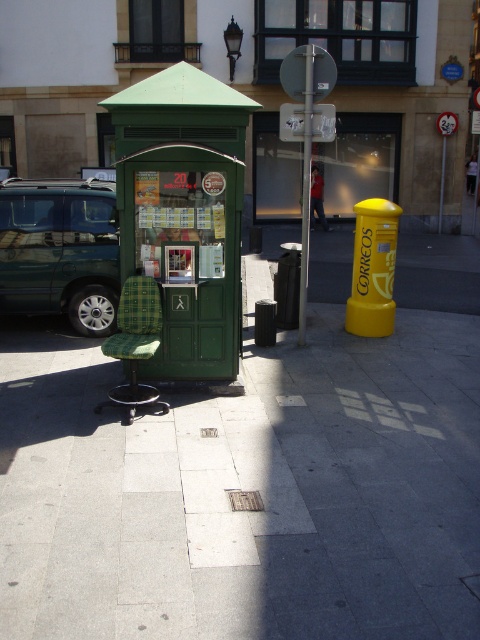
You are a bus driver who needs to park your bus at the green matte bus stop at center. However, there is a metallic silver pole at center above it. Will the pole interfere with parking the bus there?

The green matte bus stop at center is positioned under the metallic silver pole at center, so the pole is directly above the bus stop. This could potentially interfere with parking the bus there, especially if the pole is too low or extends over the parking area. The driver should check the pole height and clearance before proceeding.

You are a pedestrian trying to reach the metallic silver pole at center from the green matte bus stop at center. Which direction should you walk to get there?

The metallic silver pole at center is to the right of the green matte bus stop at center, so you should walk to the right.